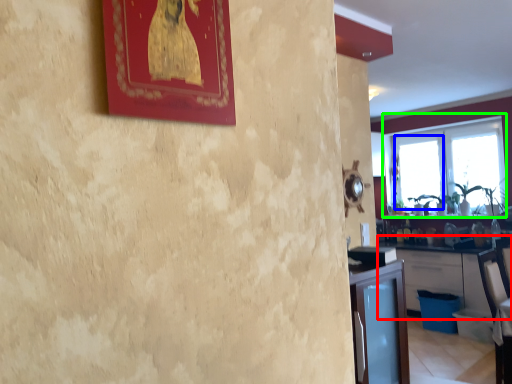
Question: Estimate the real-world distances between objects in this image. Which object is closer to cabinetry (highlighted by a red box), window (highlighted by a blue box) or window (highlighted by a green box)?

Choices:
 (A) window
 (B) window

Answer: (A)